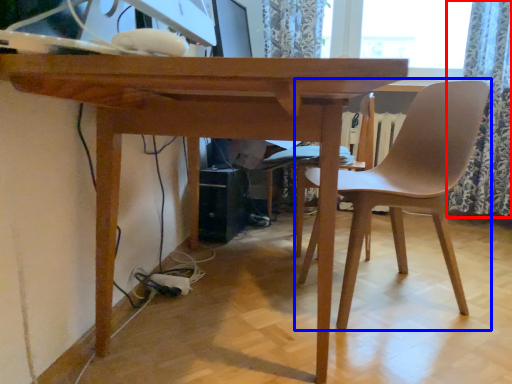
Question: Which point is further to the camera, curtain (highlighted by a red box) or chair (highlighted by a blue box)?

Choices:
 (A) curtain
 (B) chair

Answer: (A)